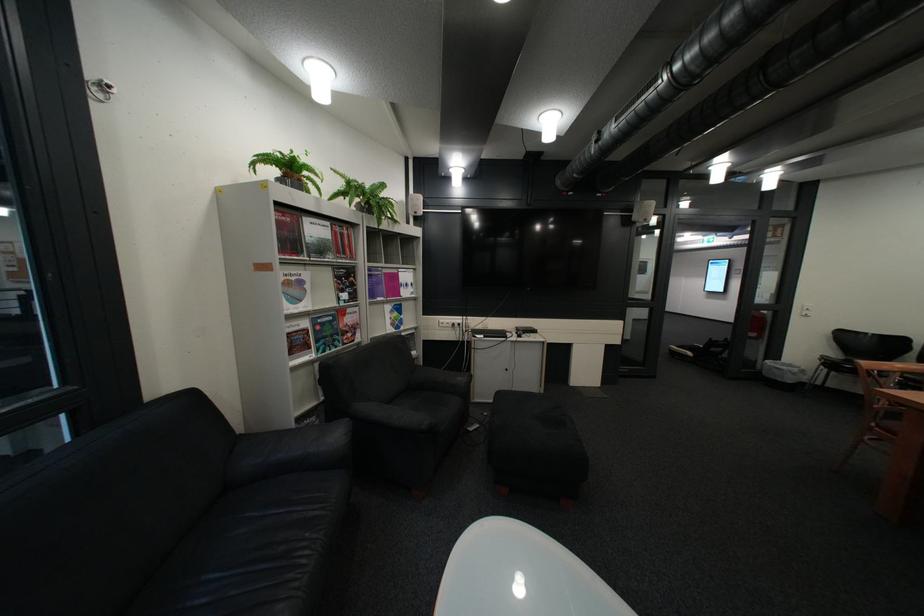
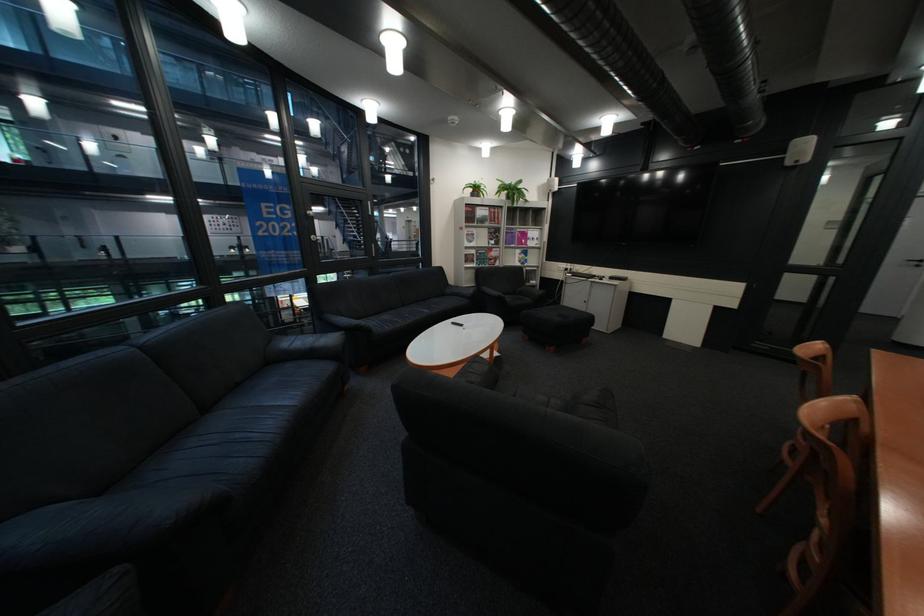
In the second image, find the point that corresponds to [353,277] in the first image.

(505, 233)